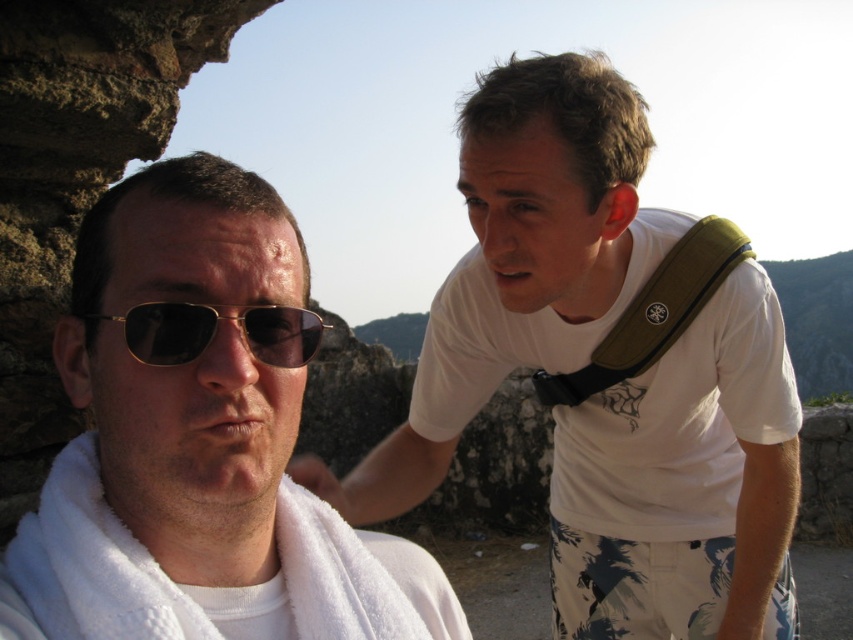
You are standing at the point marked as point (683,484) in the image. What object is directly below this point?

The point (683,484) is on the white cotton shirt at upper right, so the object directly below this point would be the white cotton shirt at upper right itself, as it is positioned at that location.

You are a photographer trying to capture both the white cotton shirt at upper right and the green fabric strap at upper right in a single frame. Since the camera has a limited focus range, which object should you prioritize focusing on to ensure it appears clearer in the photo?

The white cotton shirt at upper right is larger in size than the green fabric strap at upper right, so you should prioritize focusing on the white cotton shirt at upper right to ensure it appears clearer in the photo.

You are trying to determine the spatial relationship between the gold metallic sunglasses at left and the green fabric strap at upper right. Which one is closer to the viewer?

The green fabric strap at upper right is closer to the viewer because the gold metallic sunglasses at left is behind it.